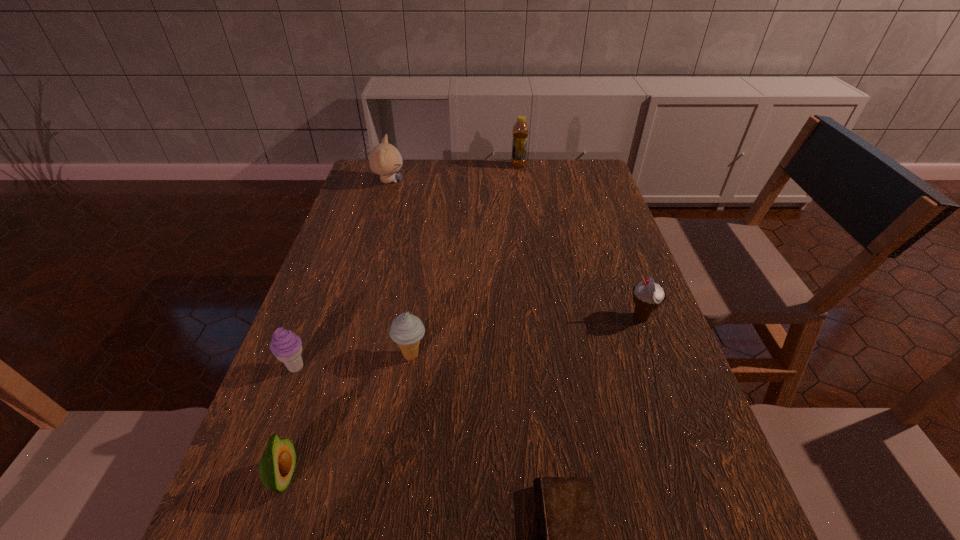
Locate an element on the screen. The image size is (960, 540). blank space that satisfies the following two spatial constraints: 1. on the back side of the second icecream from right to left; 2. on the left side of the tallest object is located at coordinates (439, 166).